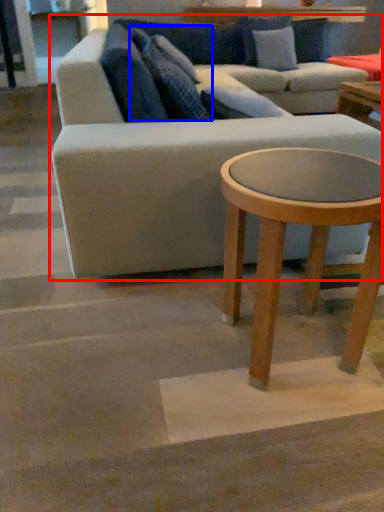
Question: Which of the following is the closest to the observer, studio couch (highlighted by a red box) or pillow (highlighted by a blue box)?

Choices:
 (A) studio couch
 (B) pillow

Answer: (A)